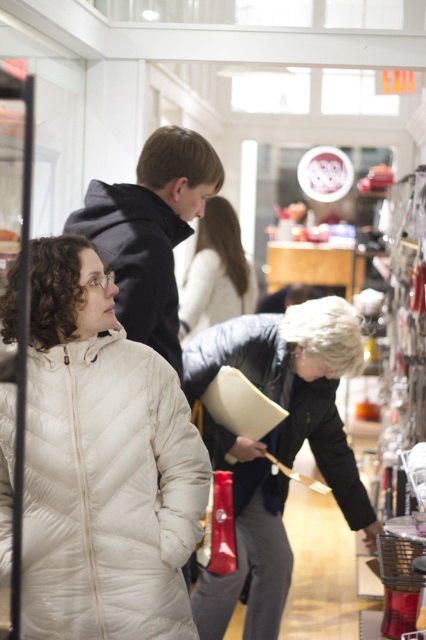
Is point (285, 422) positioned in front of point (215, 323)?

Yes, point (285, 422) is closer to viewer.

Does black quilted coat at center appear on the left side of white quilted jacket at center?

No, black quilted coat at center is not to the left of white quilted jacket at center.

What do you see at coordinates (325, 445) in the screenshot? This screenshot has height=640, width=426. I see `black quilted coat at center` at bounding box center [325, 445].

This screenshot has width=426, height=640. I want to click on black quilted coat at center, so click(x=325, y=445).

Which is in front, point (167, 490) or point (189, 324)?

Positioned in front is point (167, 490).

What do you see at coordinates (109, 493) in the screenshot?
I see `white puffer coat at center` at bounding box center [109, 493].

Image resolution: width=426 pixels, height=640 pixels. I want to click on white puffer coat at center, so click(x=109, y=493).

Can you confirm if white puffer coat at center is positioned above black quilted coat at center?

Incorrect, white puffer coat at center is not positioned above black quilted coat at center.

Does white puffer coat at center have a lesser height compared to black quilted coat at center?

Indeed, white puffer coat at center has a lesser height compared to black quilted coat at center.

The height and width of the screenshot is (640, 426). Find the location of `white puffer coat at center`. white puffer coat at center is located at coordinates (109, 493).